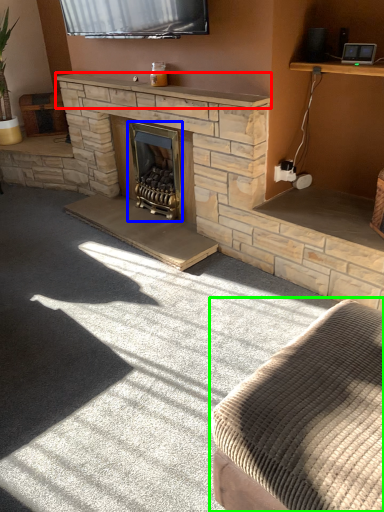
Question: Estimate the real-world distances between objects in this image. Which object is closer to mantle (highlighted by a red box), wood burning stove (highlighted by a blue box) or studio couch (highlighted by a green box)?

Choices:
 (A) wood burning stove
 (B) studio couch

Answer: (A)